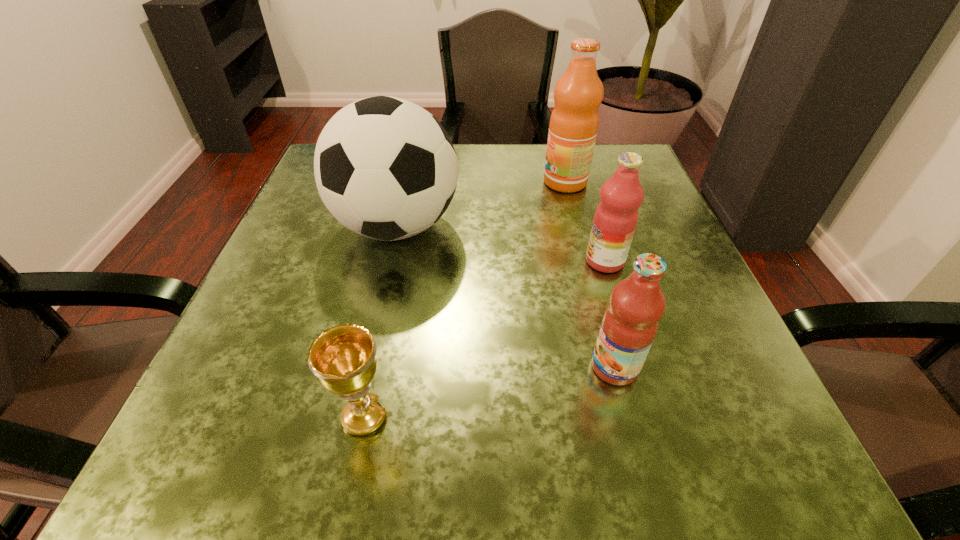
I want to click on vacant point located 0.180m on the label of the second farthest fruit juice, so pos(487,261).

At what (x,y) coordinates should I click in order to perform the action: click on vacant region located on the label of the second farthest fruit juice. Please return your answer as a coordinate pair (x, y). This screenshot has width=960, height=540. Looking at the image, I should click on (558, 261).

Where is `vacant space located on the label of the second farthest fruit juice`? vacant space located on the label of the second farthest fruit juice is located at coordinates (514, 261).

Where is `free space located on the front label of the nearest fruit juice`? free space located on the front label of the nearest fruit juice is located at coordinates (460, 367).

You are a GUI agent. You are given a task and a screenshot of the screen. Output one action in this format:
    pyautogui.click(x=<x>, y=<y>)
    Task: Click on the free space located 0.370m on the front label of the nearest fruit juice
    
    Given the screenshot: What is the action you would take?
    pyautogui.click(x=335, y=367)

At what (x,y) coordinates should I click in order to perform the action: click on vacant area located on the front label of the nearest fruit juice. Please return your answer as a coordinate pair (x, y). Looking at the image, I should click on (522, 367).

Where is `vacant region located on the right of the shortest object`? vacant region located on the right of the shortest object is located at coordinates (696, 416).

At what (x,y) coordinates should I click in order to perform the action: click on fruit juice that is at the far edge. Please return your answer as a coordinate pair (x, y). This screenshot has width=960, height=540. Looking at the image, I should click on (574, 121).

Identify the location of soccer ball at the far edge. (385, 168).

Find the location of a particular element. This screenshot has height=540, width=960. object that is positioned at the near edge is located at coordinates (343, 357).